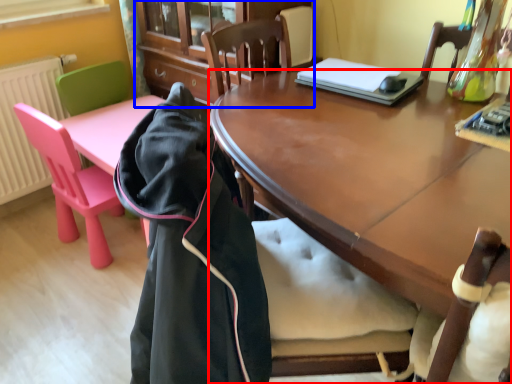
Question: Which object is further to the camera taking this photo, desk (highlighted by a red box) or cabinetry (highlighted by a blue box)?

Choices:
 (A) desk
 (B) cabinetry

Answer: (B)